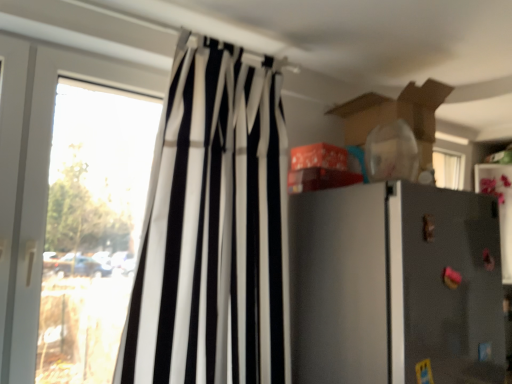
Question: From a real-world perspective, does black/white striped curtain at left stand above transparent glass window at left?

Choices:
 (A) no
 (B) yes

Answer: (B)

Question: Is black/white striped curtain at left closer to camera compared to transparent glass window at left?

Choices:
 (A) yes
 (B) no

Answer: (A)

Question: Can you confirm if black/white striped curtain at left is shorter than transparent glass window at left?

Choices:
 (A) yes
 (B) no

Answer: (B)

Question: From the image's perspective, is black/white striped curtain at left located beneath transparent glass window at left?

Choices:
 (A) yes
 (B) no

Answer: (B)

Question: Can you confirm if black/white striped curtain at left is positioned to the left of transparent glass window at left?

Choices:
 (A) yes
 (B) no

Answer: (B)

Question: Is metallic gray refrigerator at right to the left or to the right of black/white striped curtain at left in the image?

Choices:
 (A) left
 (B) right

Answer: (B)

Question: Relative to black/white striped curtain at left, is metallic gray refrigerator at right in front or behind?

Choices:
 (A) front
 (B) behind

Answer: (B)

Question: Is metallic gray refrigerator at right situated inside black/white striped curtain at left or outside?

Choices:
 (A) outside
 (B) inside

Answer: (A)

Question: In terms of size, does metallic gray refrigerator at right appear bigger or smaller than black/white striped curtain at left?

Choices:
 (A) small
 (B) big

Answer: (B)

Question: Choose the correct answer: Is metallic gray refrigerator at right inside transparent glass window at left or outside it?

Choices:
 (A) outside
 (B) inside

Answer: (A)

Question: Is metallic gray refrigerator at right taller or shorter than transparent glass window at left?

Choices:
 (A) short
 (B) tall

Answer: (A)

Question: From the image's perspective, is metallic gray refrigerator at right above or below transparent glass window at left?

Choices:
 (A) below
 (B) above

Answer: (A)

Question: From a real-world perspective, is metallic gray refrigerator at right positioned above or below transparent glass window at left?

Choices:
 (A) above
 (B) below

Answer: (B)

Question: Is transparent glass window at left in front of or behind black/white striped curtain at left in the image?

Choices:
 (A) behind
 (B) front

Answer: (A)

Question: From the image's perspective, relative to black/white striped curtain at left, is transparent glass window at left above or below?

Choices:
 (A) above
 (B) below

Answer: (B)